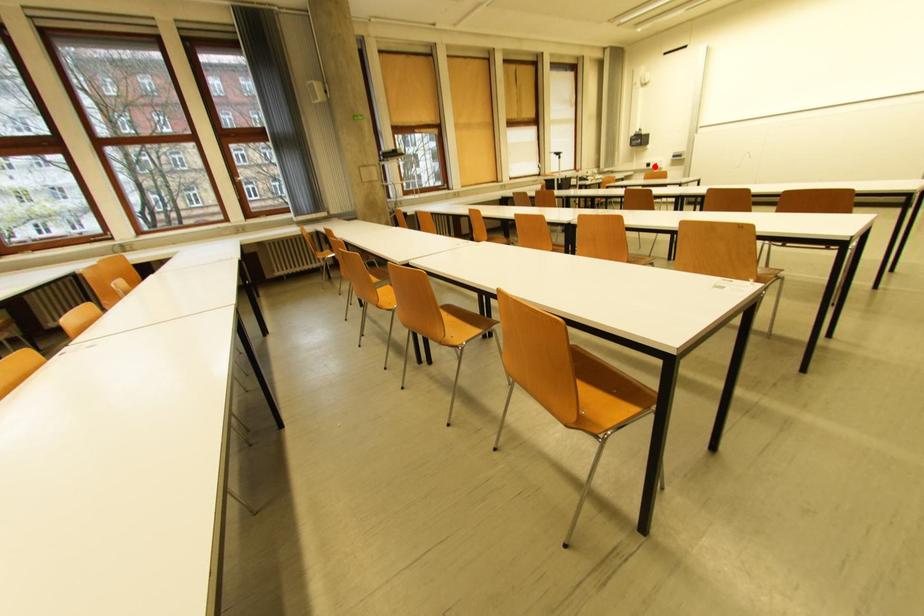
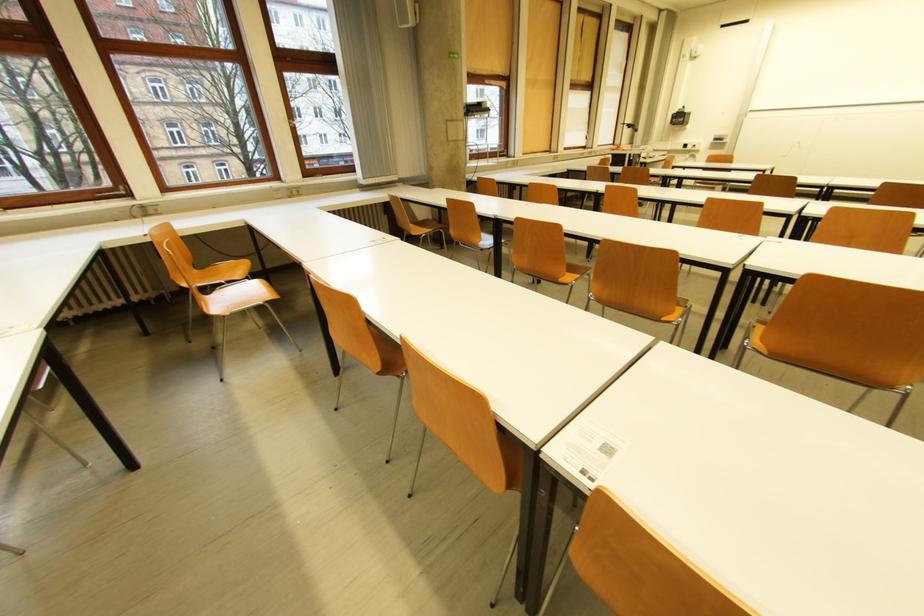
Locate, in the second image, the point that corresponds to the highlighted location in the first image.

(691, 147)